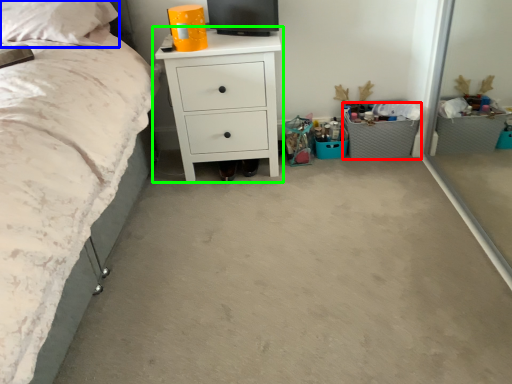
Question: Which is nearer to the crate (highlighted by a red box)? pillow (highlighted by a blue box) or chest of drawers (highlighted by a green box).

Choices:
 (A) pillow
 (B) chest of drawers

Answer: (B)